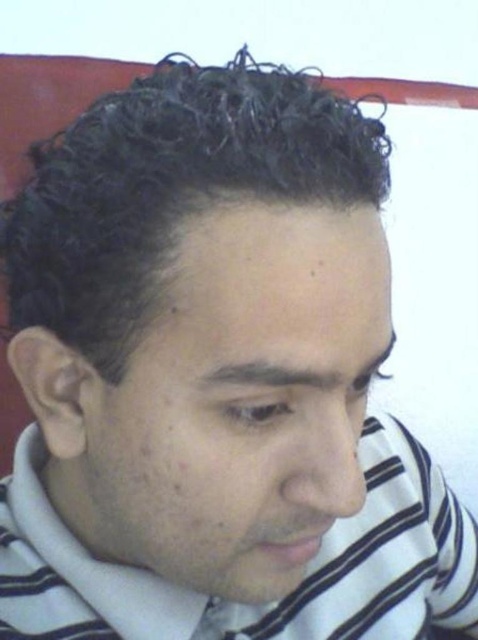
You are a fashion stylist trying to determine the proportions of the clothing items in the image. Which item, the curly black hair at upper center or the white striped dress shirt at center, has a smaller width?

The curly black hair at upper center has a lesser width compared to the white striped dress shirt at center.

You are a photographer adjusting your camera settings. You notice the curly black hair at upper center and the white striped dress shirt at center in your frame. Which object is nearer to your camera lens?

The curly black hair at upper center is closer to the viewer than the white striped dress shirt at center, so the curly black hair at upper center is nearer to the camera lens.

You are a photographer adjusting the focus on your camera. You want to ensure that the curly black hair at upper center is in sharp focus while the background remains slightly blurred. Given the distance between the camera and the subject, can you estimate if the current focus setting will achieve this effect?

The curly black hair at upper center is 11.04 inches away from the camera. To achieve sharp focus on it with a blurred background, ensure the focus point is set precisely at this distance. Adjust the aperture to a wider setting for a shallower depth of field, which will help blur the background while keeping the hair in focus.